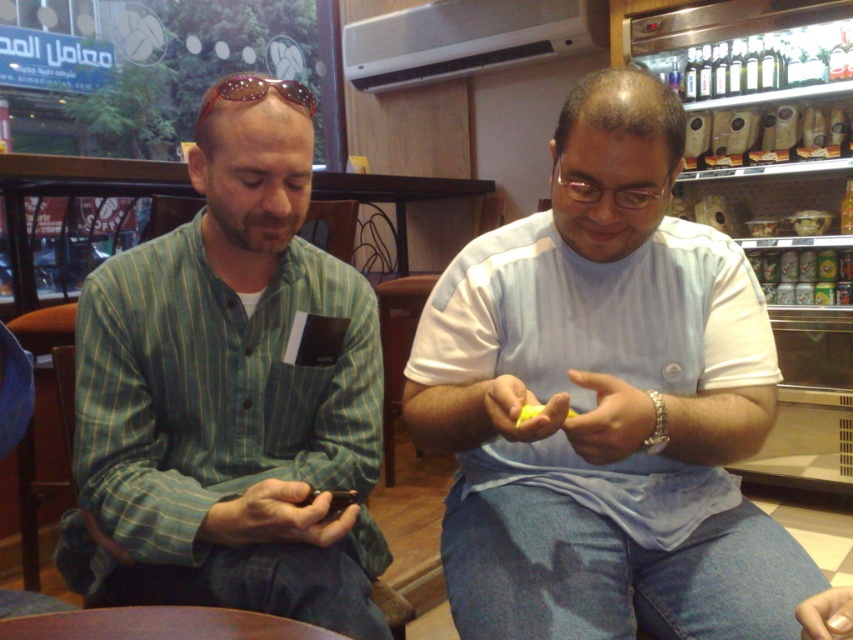
You are designing a new clothing line and need to know the relative sizes of the items in the image. Based on the scene, which object is wider between the green striped shirt at left and the sunglasses at upper center?

The green striped shirt at left is wider than the sunglasses at upper center according to the description.

You are taking a photo of the two people in the scene. You want to focus on the person closer to the camera. Which point should you adjust your camera focus to, point (474,554) or point (138,280)?

Point (474,554) is closer to the camera than point (138,280), so you should adjust your camera focus to point (474,554) to focus on the person closer to the camera.

You are a waiter in a cafe and need to deliver a drink to the person wearing the green striped shirt at left. Where should you place the drink so it is closest to them but not blocking the sunglasses at upper center?

Place the drink near the green striped shirt at left, below the sunglasses at upper center since the green striped shirt at left is located below the sunglasses at upper center.